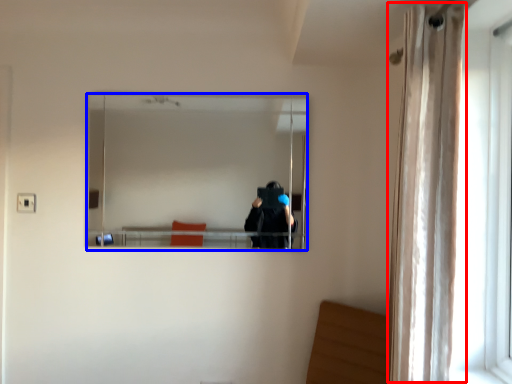
Question: Which object appears farthest to the camera in this image, curtain (highlighted by a red box) or mirror (highlighted by a blue box)?

Choices:
 (A) curtain
 (B) mirror

Answer: (B)